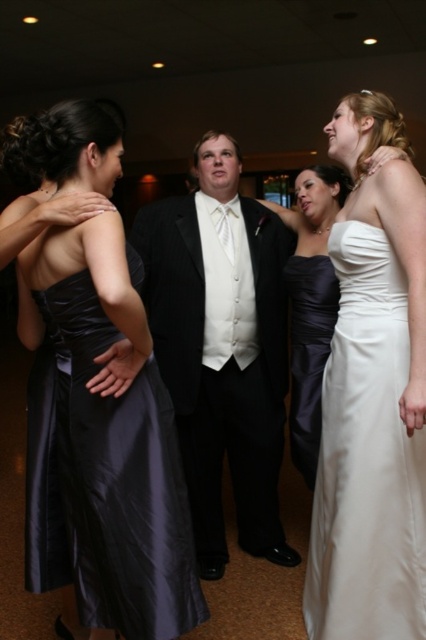
Question: Which object appears closest to the camera in this image?

Choices:
 (A) satin dress at center
 (B) black satin suit at center
 (C) satin black dress at left

Answer: (C)

Question: Can you confirm if black satin suit at center is wider than satin strapless dress at center?

Choices:
 (A) no
 (B) yes

Answer: (B)

Question: Is satin black dress at left thinner than satin dress at center?

Choices:
 (A) no
 (B) yes

Answer: (A)

Question: Estimate the real-world distances between objects in this image. Which object is farther from the satin dress at center?

Choices:
 (A) white satin dress at right
 (B) satin strapless dress at center
 (C) black satin suit at center
 (D) satin black dress at left

Answer: (D)

Question: Can you confirm if satin black dress at left is positioned below white satin dress at right?

Choices:
 (A) no
 (B) yes

Answer: (A)

Question: Among these objects, which one is farthest from the camera?

Choices:
 (A) satin dress at center
 (B) white satin dress at right
 (C) black satin suit at center
 (D) satin strapless dress at center

Answer: (A)